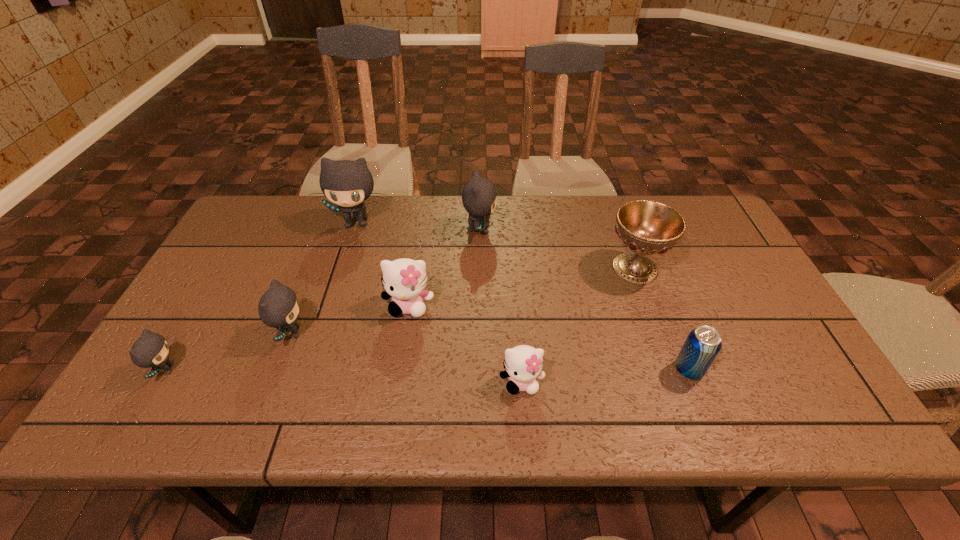
At what (x,y) coordinates should I click in order to perform the action: click on object that is at the left edge. Please return your answer as a coordinate pair (x, y). Looking at the image, I should click on (151, 350).

Locate an element on the screen. The width and height of the screenshot is (960, 540). object positioned at the near left corner is located at coordinates (151, 350).

In the image, there is a desktop. Where is `vacant space at the far edge`? vacant space at the far edge is located at coordinates (599, 208).

Locate an element on the screen. The width and height of the screenshot is (960, 540). vacant region at the near edge of the desktop is located at coordinates (561, 410).

Locate an element on the screen. This screenshot has width=960, height=540. vacant space at the left edge is located at coordinates (198, 329).

The height and width of the screenshot is (540, 960). Find the location of `vacant space at the right edge of the desktop`. vacant space at the right edge of the desktop is located at coordinates [721, 321].

I want to click on vacant position at the far left corner of the desktop, so click(275, 231).

The height and width of the screenshot is (540, 960). In the image, there is a desktop. In order to click on vacant space at the far right corner in this screenshot , I will do `click(701, 201)`.

This screenshot has width=960, height=540. I want to click on free space between the rightmost gray kitten and the farther white kitten, so click(444, 268).

This screenshot has height=540, width=960. I want to click on free space between the third biggest gray kitten and the beer can, so click(490, 351).